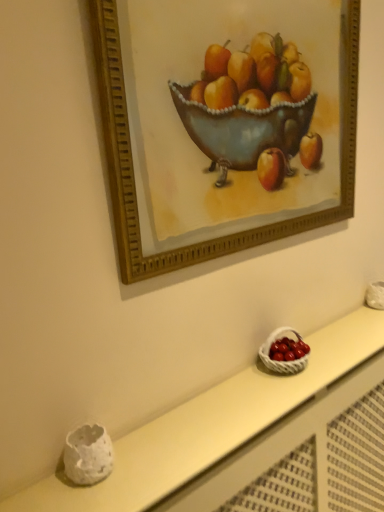
Question: From a real-world perspective, is white wicker basket at lower right beneath white wicker basket at lower right?

Choices:
 (A) no
 (B) yes

Answer: (A)

Question: Is white wicker basket at lower right completely or partially inside white wicker basket at lower right?

Choices:
 (A) yes
 (B) no

Answer: (B)

Question: Considering the relative sizes of white wicker basket at lower right and white wicker basket at lower right in the image provided, is white wicker basket at lower right bigger than white wicker basket at lower right?

Choices:
 (A) yes
 (B) no

Answer: (B)

Question: Can you confirm if white wicker basket at lower right is positioned to the left of white wicker basket at lower right?

Choices:
 (A) no
 (B) yes

Answer: (B)

Question: Does white wicker basket at lower right have a lesser height compared to white wicker basket at lower right?

Choices:
 (A) yes
 (B) no

Answer: (A)

Question: Considering their positions, is gold-framed picture at upper center located in front of or behind white wicker basket at lower right?

Choices:
 (A) front
 (B) behind

Answer: (A)

Question: From the image's perspective, is gold-framed picture at upper center above or below white wicker basket at lower right?

Choices:
 (A) above
 (B) below

Answer: (A)

Question: In terms of size, does gold-framed picture at upper center appear bigger or smaller than white wicker basket at lower right?

Choices:
 (A) small
 (B) big

Answer: (B)

Question: In terms of width, does gold-framed picture at upper center look wider or thinner when compared to white wicker basket at lower right?

Choices:
 (A) wide
 (B) thin

Answer: (B)

Question: Is white wicker basket at lower right taller or shorter than white wicker basket at lower right?

Choices:
 (A) tall
 (B) short

Answer: (B)

Question: From a real-world perspective, is white wicker basket at lower right positioned above or below white wicker basket at lower right?

Choices:
 (A) below
 (B) above

Answer: (B)

Question: Relative to white wicker basket at lower right, is white wicker basket at lower right in front or behind?

Choices:
 (A) front
 (B) behind

Answer: (B)

Question: Considering the positions of white wicker basket at lower right and white wicker basket at lower right in the image, is white wicker basket at lower right bigger or smaller than white wicker basket at lower right?

Choices:
 (A) small
 (B) big

Answer: (A)

Question: From the image's perspective, relative to gold-framed picture at upper center, is white wicker basket at lower right above or below?

Choices:
 (A) above
 (B) below

Answer: (B)

Question: Which is correct: white wicker basket at lower right is inside gold-framed picture at upper center, or outside of it?

Choices:
 (A) inside
 (B) outside

Answer: (B)